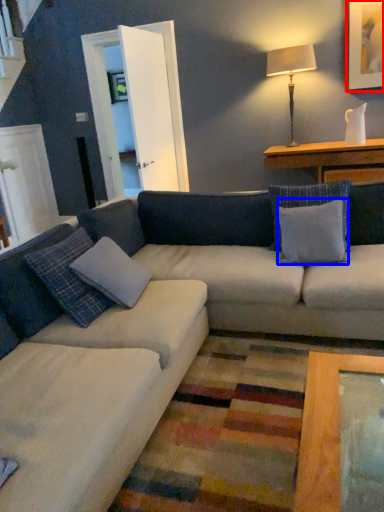
Question: Which of the following is the farthest to the observer, picture frame (highlighted by a red box) or pillow (highlighted by a blue box)?

Choices:
 (A) picture frame
 (B) pillow

Answer: (A)